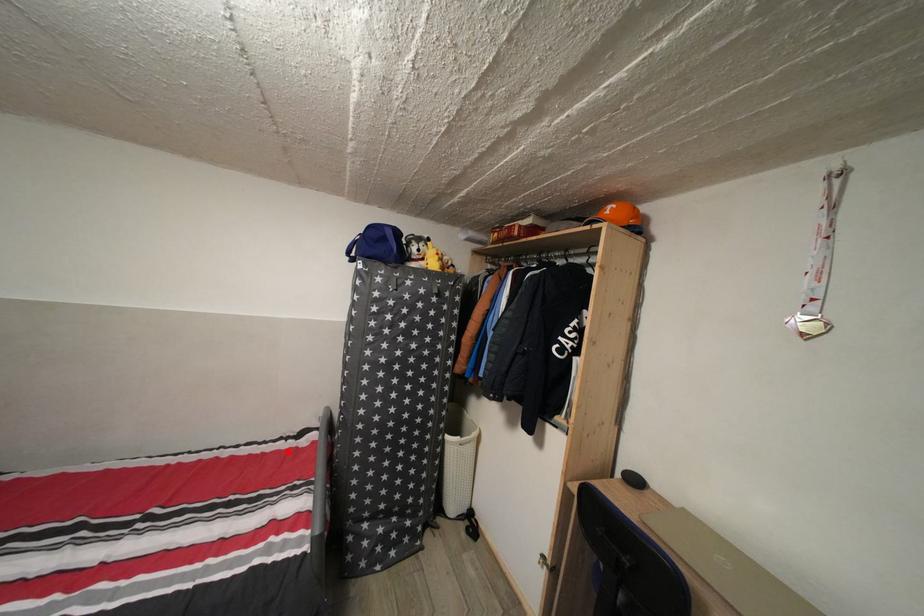
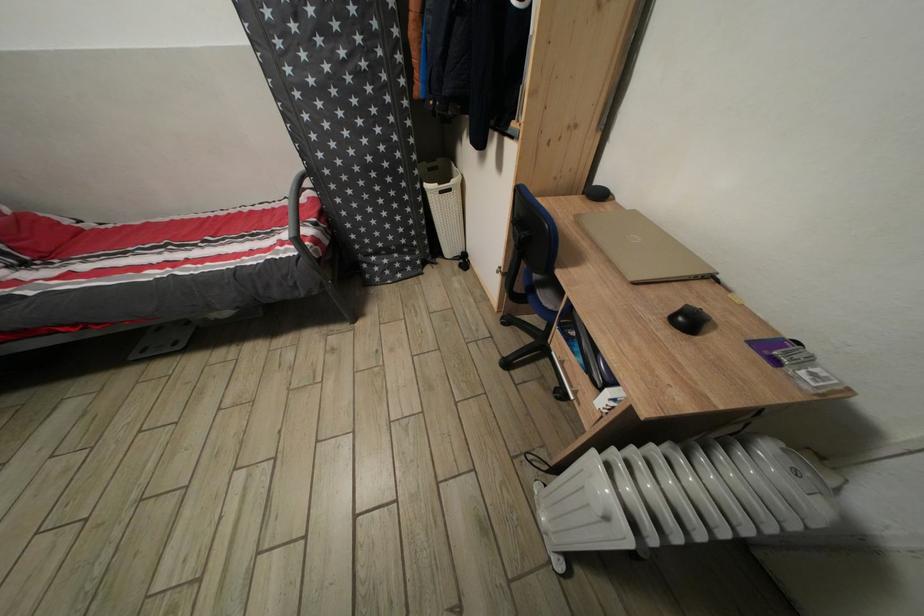
Locate, in the second image, the point that corresponds to the highlighted location in the first image.

(294, 209)